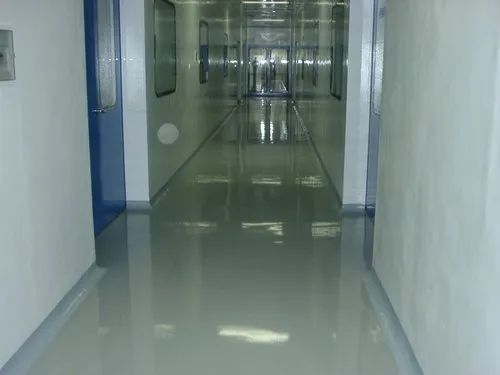
Image resolution: width=500 pixels, height=375 pixels. I want to click on door handle, so click(x=98, y=108).